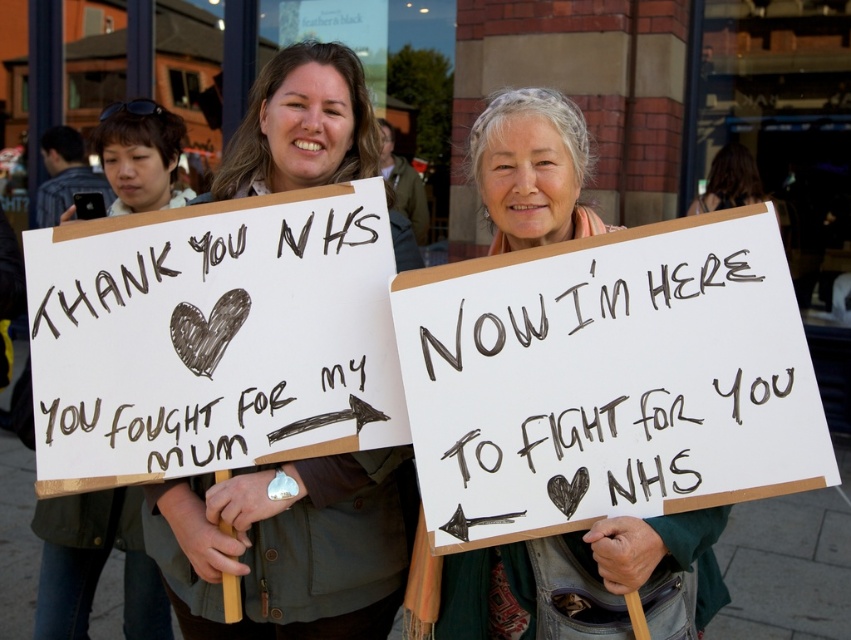
From the picture: You are a photographer trying to capture a clear shot of both the black handwritten text at center and the green fabric scarf at center. Based on their positions, which one should you focus on first to ensure both are in frame?

The black handwritten text at center is above the green fabric scarf at center, so you should focus on the black handwritten text at center first to ensure both are in frame.